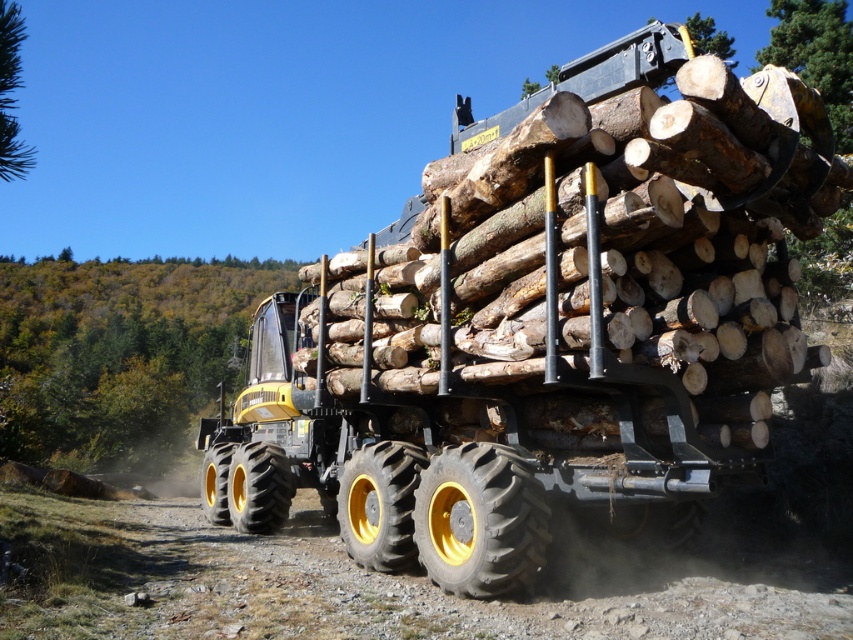
You are a forest ranger assessing the scene. Based on the coordinates provided, which object is located at point [119,355]?

The point [119,355] corresponds to the green leafy tree at upper left.